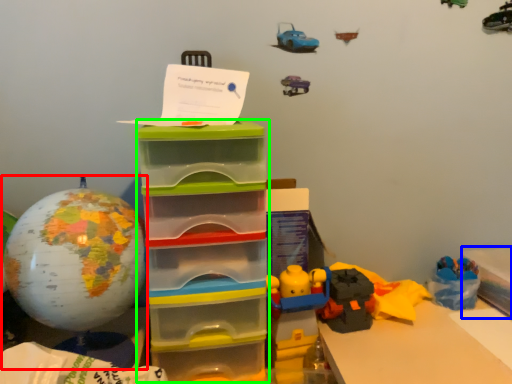
Question: Which object is positioned closest to toy (highlighted by a red box)? Select from storage box (highlighted by a blue box) and storage box (highlighted by a green box).

Choices:
 (A) storage box
 (B) storage box

Answer: (B)